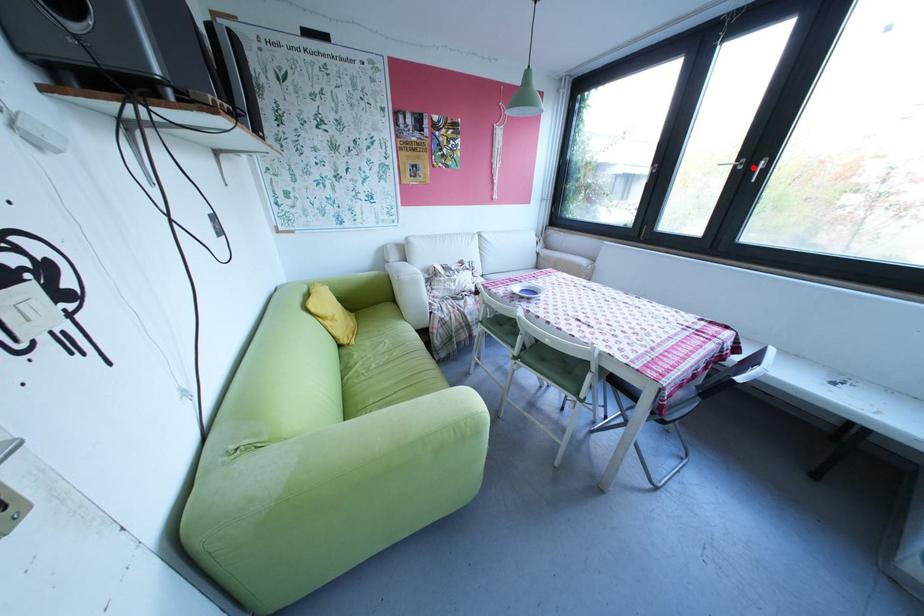
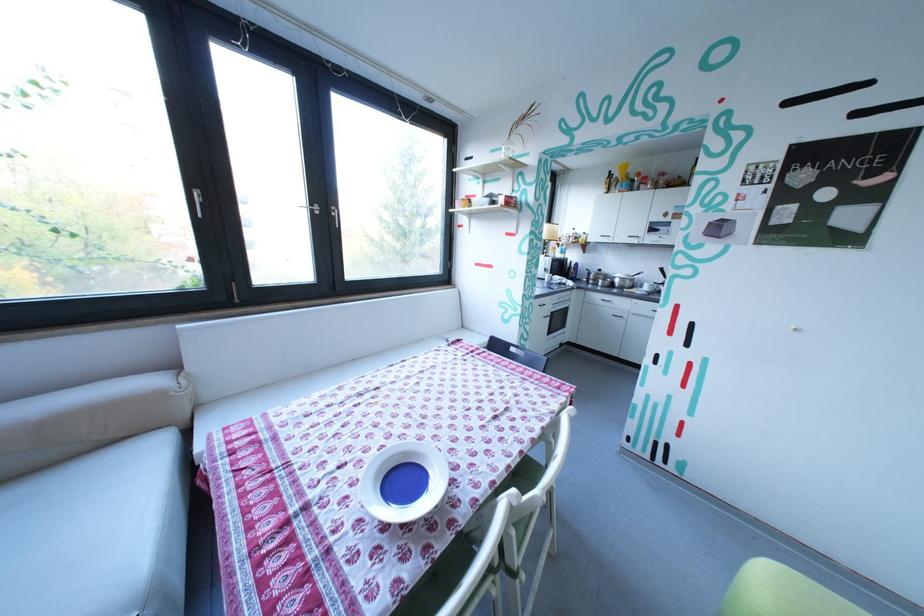
The point at the highlighted location is marked in the first image. Where is the corresponding point in the second image?

(331, 213)